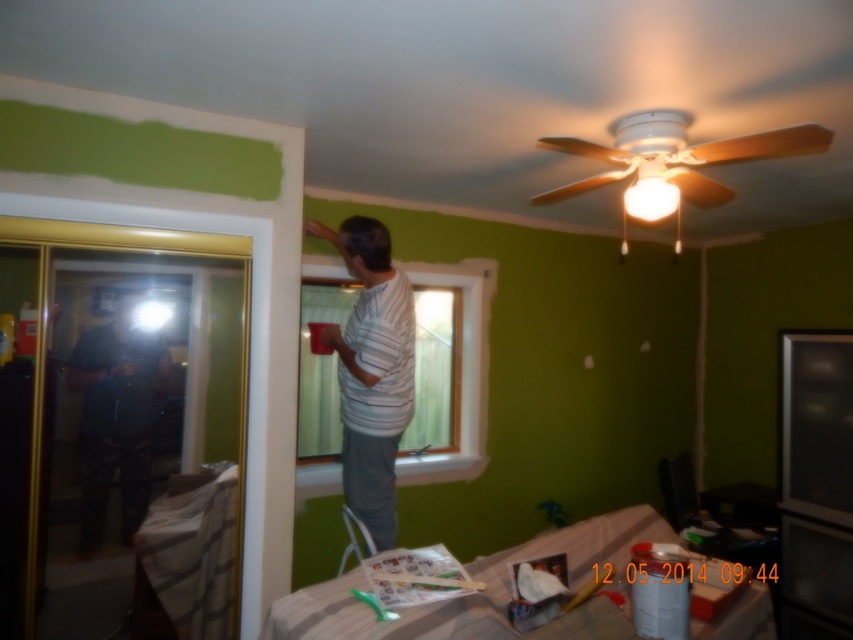
Based on the photo, you are an interior designer observing the renovation scene. You notice the dark blue shirt at left and the clear glass window at center. Which object takes up less space in the image?

The dark blue shirt at left is smaller than the clear glass window at center, so it takes up less space in the image.

You are a painter working in the room and need to place a ladder near the window to reach the upper walls. Given the position of the white striped shirt at center and the clear glass window at center, which object should you move out of the way first?

You should move the white striped shirt at center first because it is positioned to the left of the clear glass window at center, blocking access to the window area where the ladder needs to be placed.

You are trying to decide which shirt to take from the table in the room. The white striped shirt at center and the dark blue shirt at left are both on the table. Which shirt is closer to you?

The white striped shirt at center is closer to you because it is further to the viewer than the dark blue shirt at left.